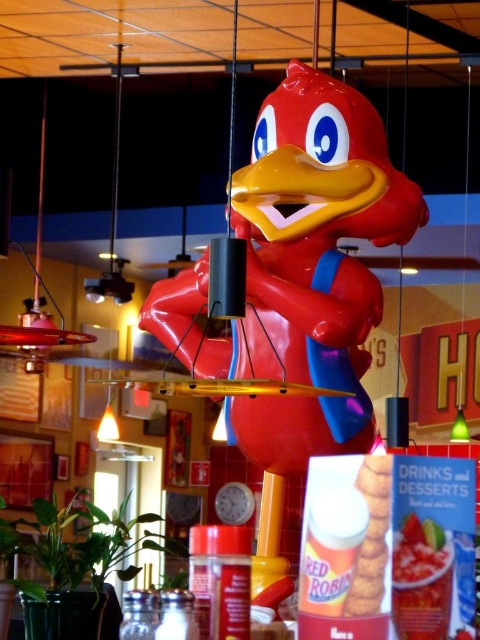
Between shiny plastic duck at center and glossy plastic salsa cup at lower center, which one appears on the right side from the viewer's perspective?

From the viewer's perspective, glossy plastic salsa cup at lower center appears more on the right side.

Can you confirm if shiny plastic duck at center is positioned above glossy plastic salsa cup at lower center?

Yes.

Who is more distant from viewer, (363, 397) or (407, 525)?

The point (363, 397) is behind.

Identify the location of shiny plastic duck at center. The width and height of the screenshot is (480, 640). (298, 288).

Does glossy plastic salsa cup at lower center have a smaller size compared to matte plastic french fries at center?

Correct, glossy plastic salsa cup at lower center occupies less space than matte plastic french fries at center.

Between point (405, 573) and point (384, 454), which one is positioned in front?

Point (405, 573) is more forward.

The image size is (480, 640). I want to click on glossy plastic salsa cup at lower center, so click(x=420, y=580).

Is shiny plastic duck at center to the right of matte plastic french fries at center from the viewer's perspective?

In fact, shiny plastic duck at center is to the left of matte plastic french fries at center.

Does point (291, 70) lie behind point (372, 538)?

Yes, point (291, 70) is farther from viewer.

Find the location of `shiny plastic duck at center`. shiny plastic duck at center is located at coordinates (298, 288).